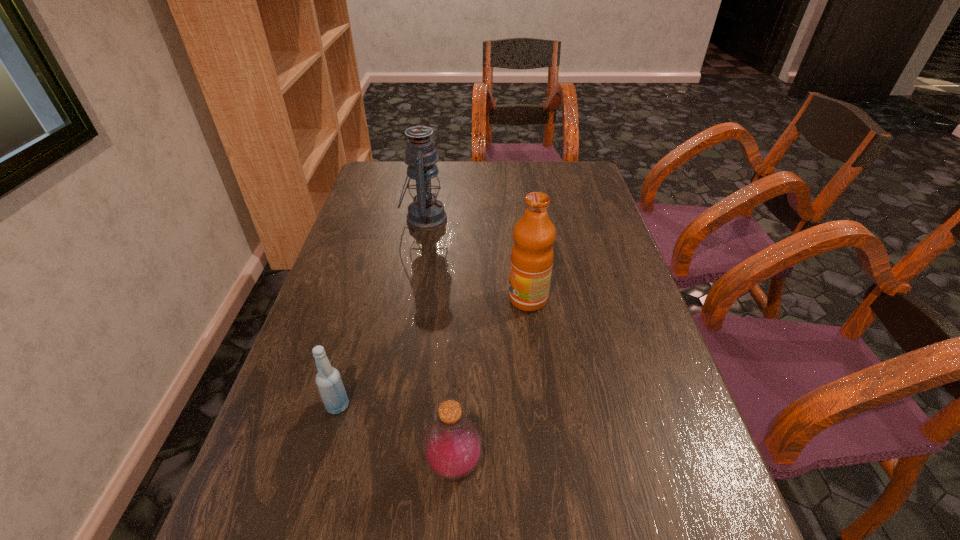
The image size is (960, 540). Identify the location of vacant position located 0.300m on the label side of the third nearest object. (385, 299).

The image size is (960, 540). In order to click on free region located 0.240m on the label side of the third nearest object in this screenshot , I will do 410,299.

Find the location of a particular element. This screenshot has width=960, height=540. free location located 0.320m on the right of the nearer bottle is located at coordinates (668, 465).

Where is `vacant area located 0.140m on the back of the farther bottle`? vacant area located 0.140m on the back of the farther bottle is located at coordinates (355, 341).

The height and width of the screenshot is (540, 960). Identify the location of lantern located at the left edge. (425, 213).

Where is `bottle that is at the left edge`? The width and height of the screenshot is (960, 540). bottle that is at the left edge is located at coordinates (328, 379).

Find the location of `free region at the far edge of the desktop`. free region at the far edge of the desktop is located at coordinates (480, 193).

In the image, there is a desktop. At what (x,y) coordinates should I click in order to perform the action: click on free space at the left edge. Please return your answer as a coordinate pair (x, y). Image resolution: width=960 pixels, height=540 pixels. Looking at the image, I should click on (311, 366).

In the image, there is a desktop. What are the coordinates of `vacant space at the right edge` in the screenshot? It's located at (556, 217).

Locate an element on the screen. The height and width of the screenshot is (540, 960). vacant point located between the third nearest object and the farthest object is located at coordinates (476, 259).